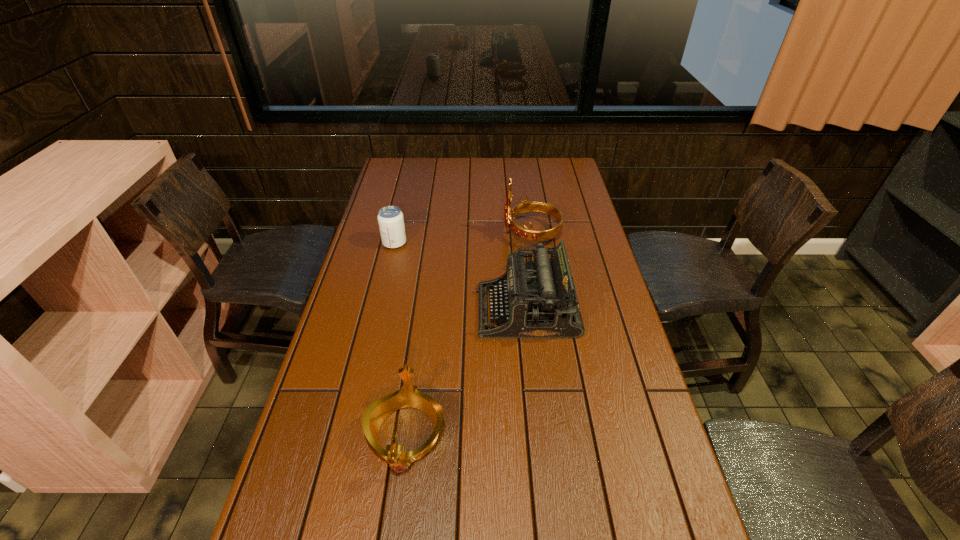
The image size is (960, 540). I want to click on free space located 0.170m on the keyboard of the second tallest object, so click(x=419, y=310).

Find the location of `vacant space located on the keyboard of the second tallest object`. vacant space located on the keyboard of the second tallest object is located at coordinates (405, 310).

This screenshot has width=960, height=540. I want to click on vacant space located 0.250m on the keyboard of the second tallest object, so click(392, 310).

What are the coordinates of `vacant space located on the back of the soda can` in the screenshot? It's located at (405, 198).

The width and height of the screenshot is (960, 540). Find the location of `vacant space situated at the front emblem of the shorter tiara`. vacant space situated at the front emblem of the shorter tiara is located at coordinates (394, 529).

The image size is (960, 540). Find the location of `soda can that is at the left edge`. soda can that is at the left edge is located at coordinates (390, 219).

Find the location of a particular element. tiara situated at the left edge is located at coordinates (407, 396).

Where is `tiara that is positioned at the right edge`? This screenshot has width=960, height=540. tiara that is positioned at the right edge is located at coordinates (525, 233).

At what (x,y) coordinates should I click in order to perform the action: click on typewriter at the right edge. Please return your answer as a coordinate pair (x, y). The image size is (960, 540). Looking at the image, I should click on (539, 300).

Image resolution: width=960 pixels, height=540 pixels. In the image, there is a desktop. What are the coordinates of `free space at the left edge` in the screenshot? It's located at (382, 266).